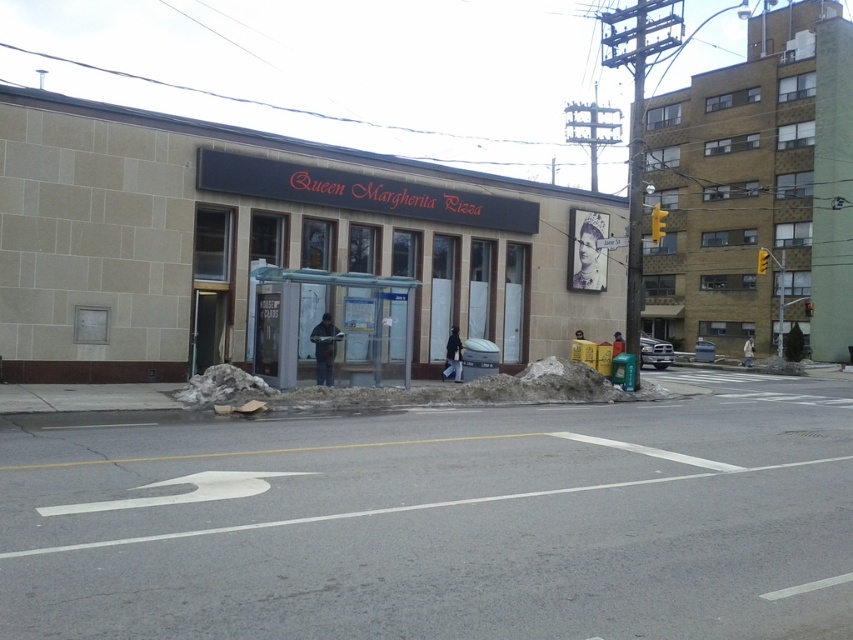
Between beige stone building at center and white snow at center, which one appears on the right side from the viewer's perspective?

white snow at center is more to the right.

In the scene shown: Is beige stone building at center further to camera compared to white snow at center?

Yes, beige stone building at center is behind white snow at center.

Does point (144, 182) come farther from viewer compared to point (218, 401)?

Yes, it is.

Where is `beige stone building at center`? This screenshot has width=853, height=640. beige stone building at center is located at coordinates (259, 241).

Does beige stone building at center lie in front of black matte sign at center?

That is True.

Which is more to the left, beige stone building at center or black matte sign at center?

black matte sign at center

Who is more forward, (80, 212) or (415, 202)?

Point (80, 212) is in front.

I want to click on beige stone building at center, so click(259, 241).

Consider the image. Who is lower down, black matte sign at center or white snow at center?

white snow at center is below.

Who is taller, black matte sign at center or white snow at center?

Standing taller between the two is black matte sign at center.

Which is behind, point (459, 189) or point (187, 404)?

The point (459, 189) is more distant.

What are the coordinates of `black matte sign at center` in the screenshot? It's located at coord(361,193).